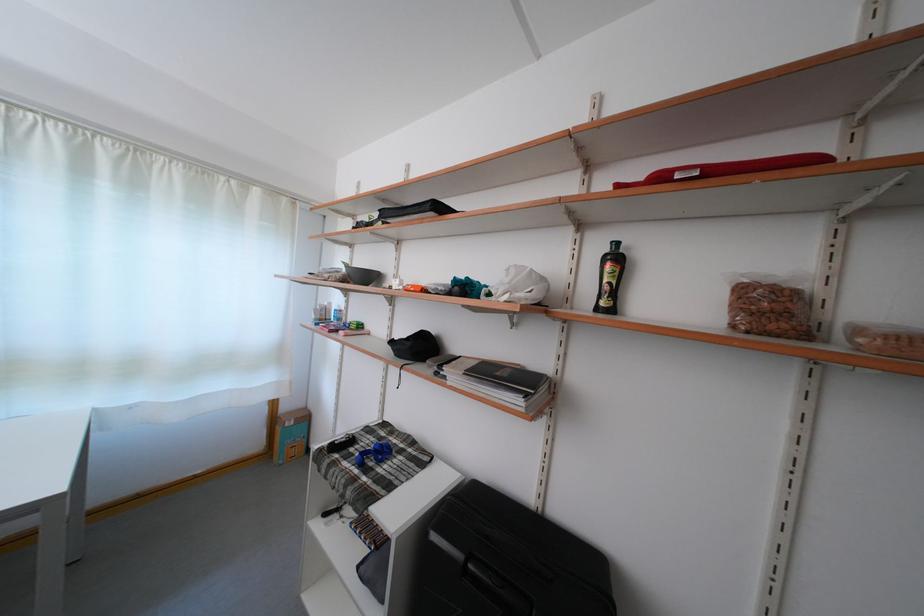
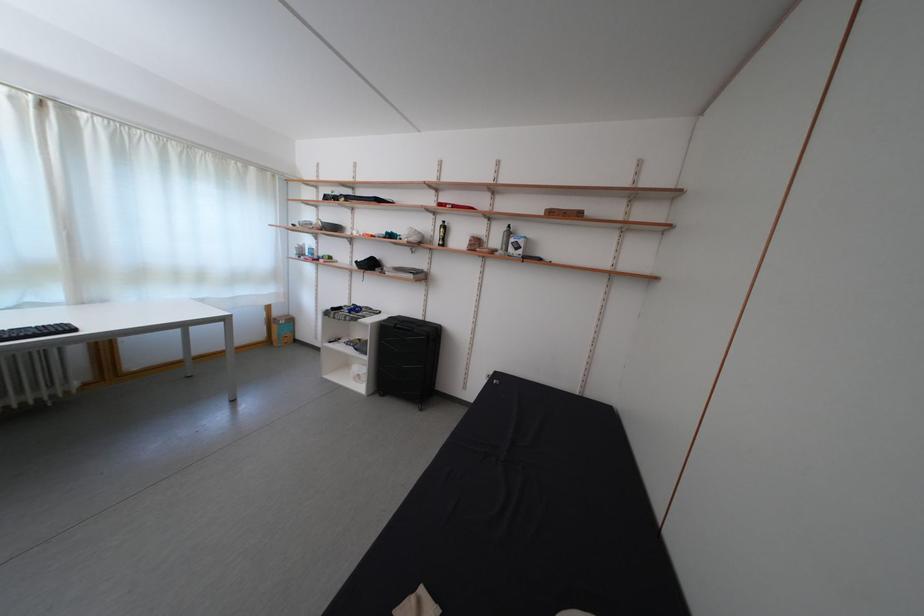
Where in the second image is the point corresponding to (581,292) from the first image?

(442, 241)